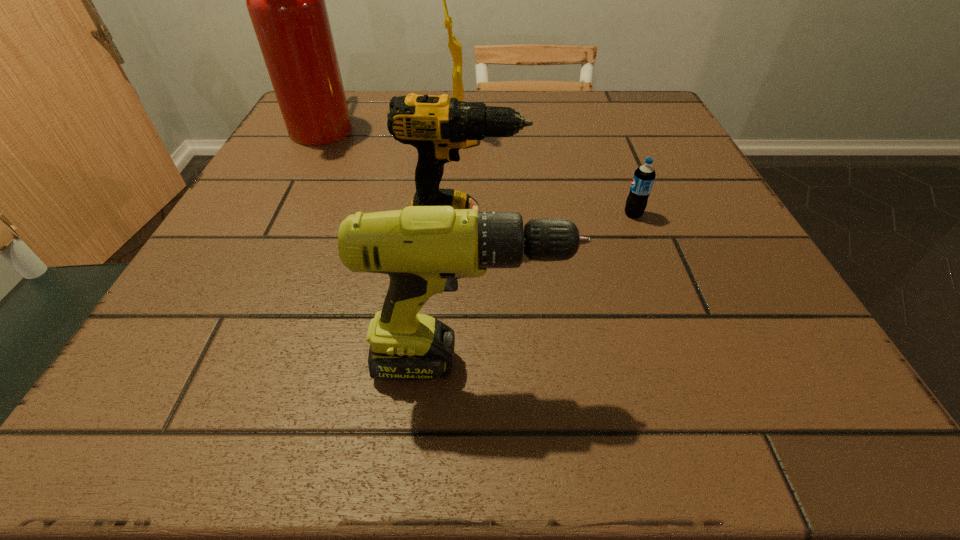
This screenshot has height=540, width=960. I want to click on free space at the left edge, so click(x=288, y=213).

What are the coordinates of `vacant area at the right edge` in the screenshot? It's located at (701, 325).

Find the location of a particular element. vacant space at the far right corner of the desktop is located at coordinates (617, 91).

The height and width of the screenshot is (540, 960). Find the location of `vacant space that is in between the nearest object and the rightmost object`. vacant space that is in between the nearest object and the rightmost object is located at coordinates (550, 289).

Where is `vacant space that is in between the shortest object and the award`? The height and width of the screenshot is (540, 960). vacant space that is in between the shortest object and the award is located at coordinates (544, 174).

This screenshot has width=960, height=540. I want to click on free space that is in between the second tallest object and the rightmost object, so click(544, 174).

Find the location of a particular element. vacant space that is in between the nearest object and the rightmost object is located at coordinates (550, 289).

Identify the location of unoccupied position between the leftmost object and the farther drill. (395, 177).

What are the coordinates of `free area in between the soda bottle and the nearest object` in the screenshot? It's located at (550, 289).

At what (x,y) coordinates should I click in order to perform the action: click on object that can be found as the closest to the award. Please return your answer as a coordinate pair (x, y). Looking at the image, I should click on (285, 0).